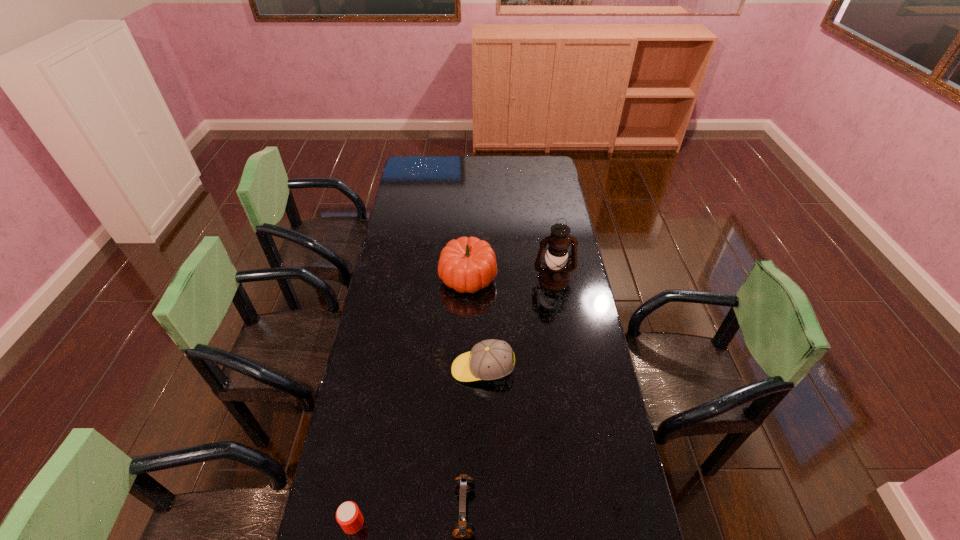
I want to click on the rightmost object, so click(x=554, y=275).

Identify the location of lantern. The image size is (960, 540). (554, 275).

You are a GUI agent. You are given a task and a screenshot of the screen. Output one action in this format:
    pyautogui.click(x=<x>, y=<y>)
    Task: Click on the second tallest object
    The width and height of the screenshot is (960, 540).
    Given the screenshot: What is the action you would take?
    pyautogui.click(x=466, y=264)

The width and height of the screenshot is (960, 540). Identify the location of baseball cap. (491, 359).

Find the location of a particular element. beer can is located at coordinates (348, 515).

Where is `the shortest object`? the shortest object is located at coordinates (348, 515).

Find the location of a particular element. This screenshot has width=960, height=540. free space located 0.250m on the side of the rightmost object, there is a wick adjustment knob is located at coordinates (564, 340).

Locate an element on the screen. The image size is (960, 540). free region located on the left of the second tallest object is located at coordinates (427, 277).

Find the location of `vacant space located on the front-facing side of the baseball cap`. vacant space located on the front-facing side of the baseball cap is located at coordinates (420, 369).

The height and width of the screenshot is (540, 960). I want to click on vacant space situated 0.300m on the front-facing side of the baseball cap, so click(x=366, y=369).